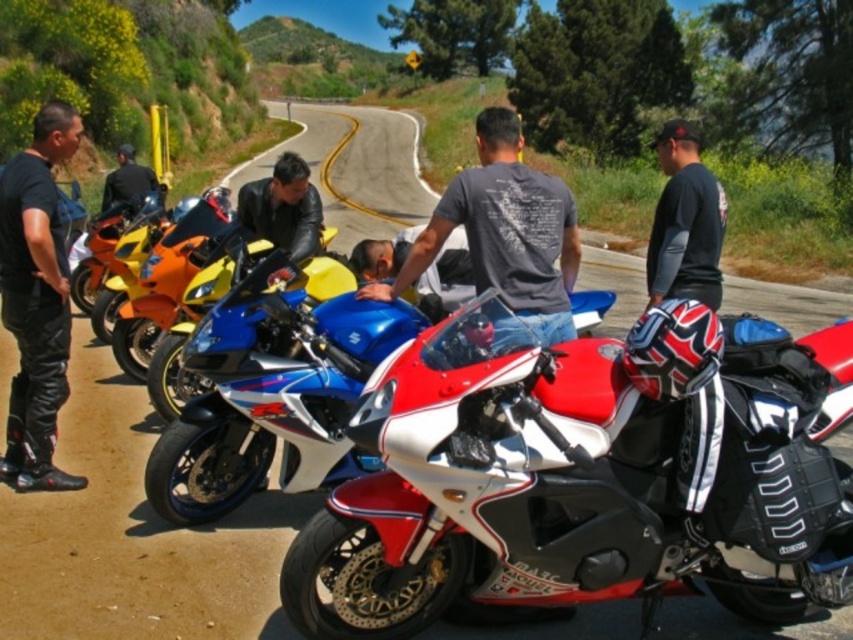
Question: Where is black leather jacket at right located in relation to leather jacket at center in the image?

Choices:
 (A) below
 (B) above

Answer: (A)

Question: Based on their relative distances, which object is nearer to the shiny white and red motorcycle at center?

Choices:
 (A) black leather pants at left
 (B) black leather jacket at left
 (C) black leather jacket at right
 (D) shiny red and white motorcycle at center

Answer: (D)

Question: Can you confirm if black leather jacket at right is positioned below black leather jacket at left?

Choices:
 (A) yes
 (B) no

Answer: (A)

Question: Can you confirm if shiny white and red motorcycle at center is thinner than gray cotton t-shirt at center?

Choices:
 (A) no
 (B) yes

Answer: (A)

Question: Among these points, which one is farthest from the camera?

Choices:
 (A) (235, 289)
 (B) (718, 376)
 (C) (521, 179)

Answer: (A)

Question: Which object is the closest to the gray cotton t-shirt at center?

Choices:
 (A) leather jacket at center
 (B) black leather jacket at left
 (C) shiny white and red motorcycle at center
 (D) shiny red and white motorcycle at center

Answer: (C)